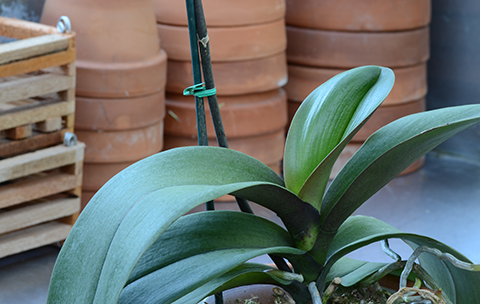
The image size is (480, 304). Identify the location of floor. (418, 216).